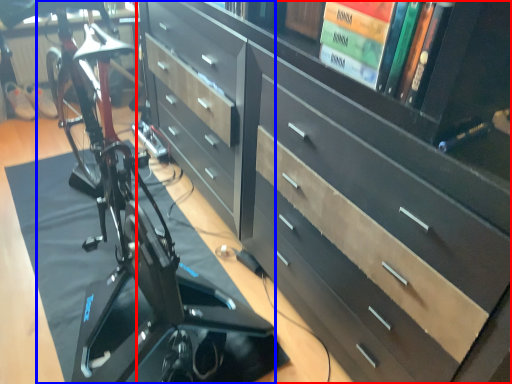
Question: Which object appears farthest to the camera in this image, chest of drawers (highlighted by a red box) or bicycle (highlighted by a blue box)?

Choices:
 (A) chest of drawers
 (B) bicycle

Answer: (B)